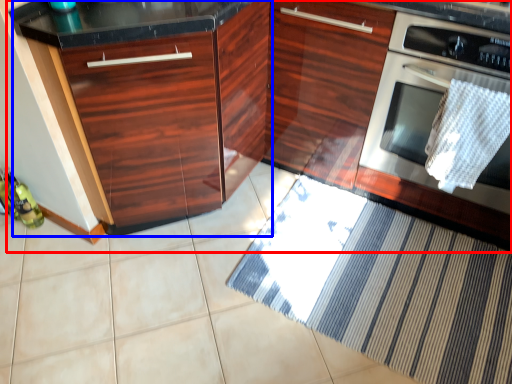
Question: Which point is further to the camera, cabinetry (highlighted by a red box) or cabinetry (highlighted by a blue box)?

Choices:
 (A) cabinetry
 (B) cabinetry

Answer: (B)